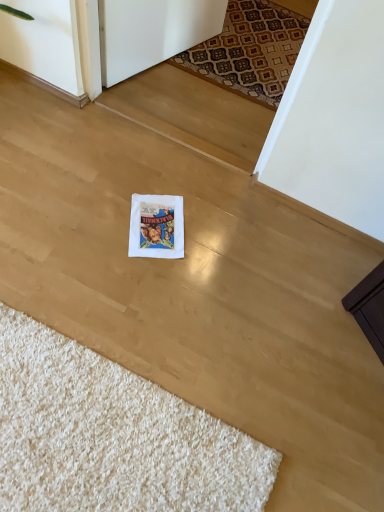
You are a GUI agent. You are given a task and a screenshot of the screen. Output one action in this format:
    pyautogui.click(x=<x>, y=<y>)
    Task: Click on the free location to the left of white paper postcard at center
    
    Given the screenshot: What is the action you would take?
    pyautogui.click(x=103, y=217)